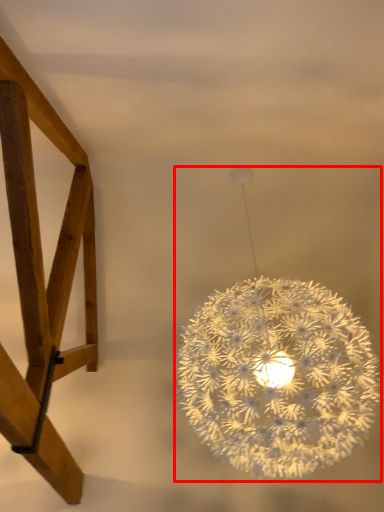
Question: Observing the image, what is the correct spatial positioning of lamp (annotated by the red box) in reference to furniture?

Choices:
 (A) right
 (B) left

Answer: (A)